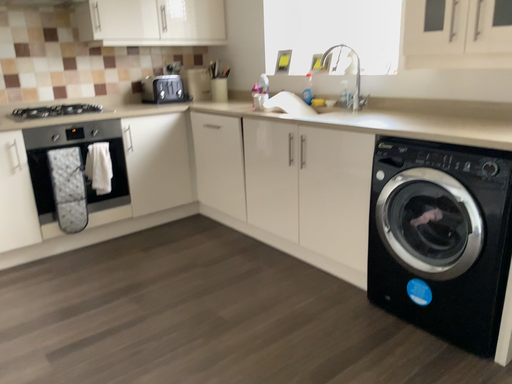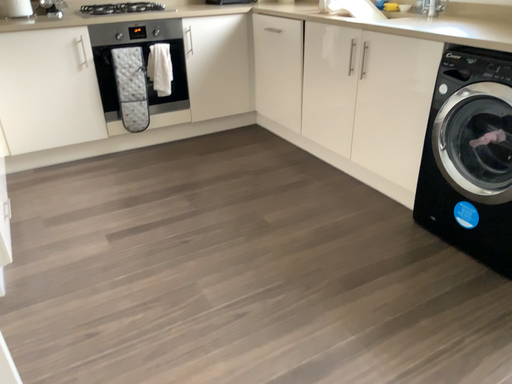
Question: How did the camera likely rotate when shooting the video?

Choices:
 (A) rotated downward
 (B) rotated upward

Answer: (A)